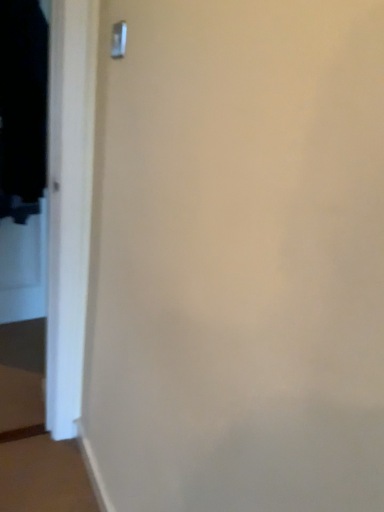
What is the approximate height of transparent glass screen door at left?

transparent glass screen door at left is 5.50 feet tall.

The image size is (384, 512). What do you see at coordinates (23, 160) in the screenshot? I see `transparent glass screen door at left` at bounding box center [23, 160].

The height and width of the screenshot is (512, 384). Identify the location of transparent glass screen door at left. (23, 160).

Locate an element on the screen. The width and height of the screenshot is (384, 512). transparent glass screen door at left is located at coordinates (23, 160).